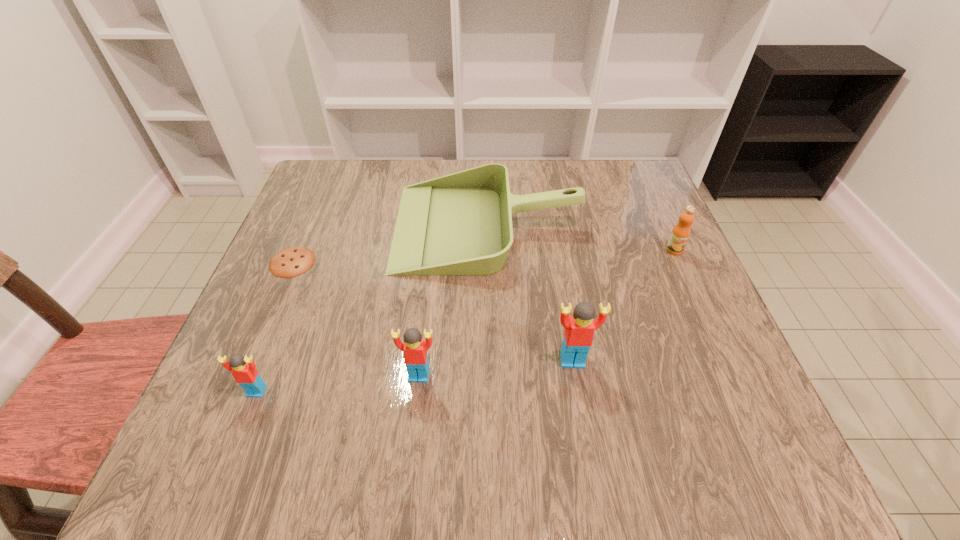
You are a GUI agent. You are given a task and a screenshot of the screen. Output one action in this format:
    pyautogui.click(x=<x>, y=<y>)
    Task: Click on the shortest Lego
    
    Given the screenshot: What is the action you would take?
    pyautogui.click(x=244, y=371)

Identify the location of the leftmost Lego. (244, 371).

Find the location of a particular element. This screenshot has height=540, width=960. the second shortest Lego is located at coordinates pyautogui.click(x=414, y=348).

At what (x,y) coordinates should I click in order to perform the action: click on the tallest Lego. Please return your answer as a coordinate pair (x, y). This screenshot has width=960, height=540. Looking at the image, I should click on 579,329.

Where is `the tallest object`? the tallest object is located at coordinates (579, 329).

The width and height of the screenshot is (960, 540). In order to click on dustpan in this screenshot , I will do `click(460, 224)`.

The image size is (960, 540). Find the location of `cookie`. cookie is located at coordinates (290, 262).

This screenshot has width=960, height=540. I want to click on orange juice, so click(680, 234).

Where is `blank space located on the scoop of the dustpan`? The width and height of the screenshot is (960, 540). blank space located on the scoop of the dustpan is located at coordinates (341, 226).

At what (x,y) coordinates should I click in order to perform the action: click on vacant region located on the scoop of the dustpan. Please return your answer as a coordinate pair (x, y). The width and height of the screenshot is (960, 540). Looking at the image, I should click on (333, 226).